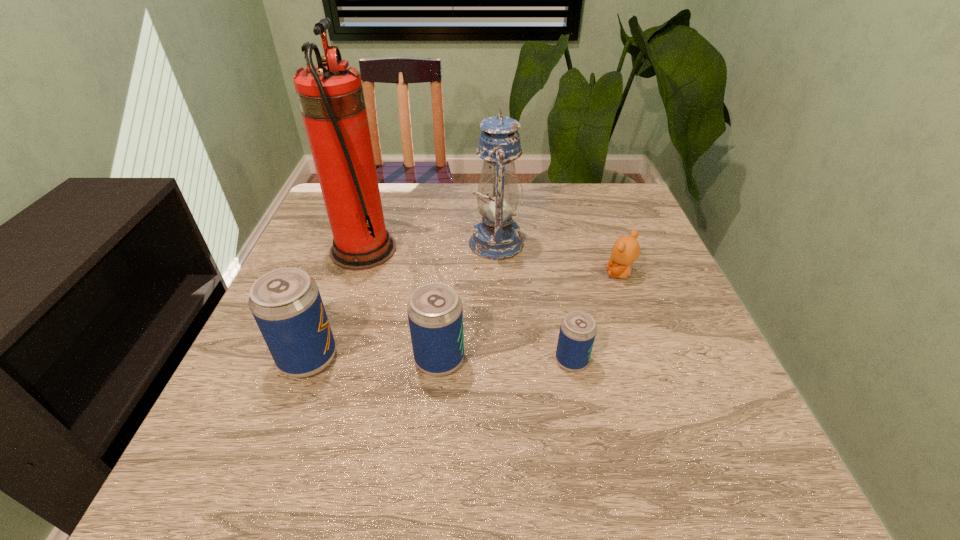
At what (x,y) coordinates should I click in order to perform the action: click on beer can that is positioned at the left edge. Please return your answer as a coordinate pair (x, y). This screenshot has width=960, height=540. Looking at the image, I should click on (286, 303).

Identify the location of fire extinguisher located in the left edge section of the desktop. (331, 99).

Locate an element on the screen. object positioned at the right edge is located at coordinates (626, 249).

In the image, there is a desktop. Identify the location of vacant space at the far edge. (386, 215).

Identify the location of blank space at the near edge of the desktop. (519, 431).

The image size is (960, 540). In the image, there is a desktop. In order to click on free region at the left edge in this screenshot , I will do `click(322, 281)`.

Where is `vacant space at the near left corner`? The height and width of the screenshot is (540, 960). vacant space at the near left corner is located at coordinates (313, 400).

Where is `vacant area that lies between the third object from right to left and the fourth object from right to left`? The height and width of the screenshot is (540, 960). vacant area that lies between the third object from right to left and the fourth object from right to left is located at coordinates (468, 301).

Image resolution: width=960 pixels, height=540 pixels. What are the coordinates of `vacant region between the fire extinguisher and the third object from right to left` in the screenshot? It's located at (430, 246).

Image resolution: width=960 pixels, height=540 pixels. Identify the location of unoccupied position between the fire extinguisher and the fifth object from left to right. (468, 305).